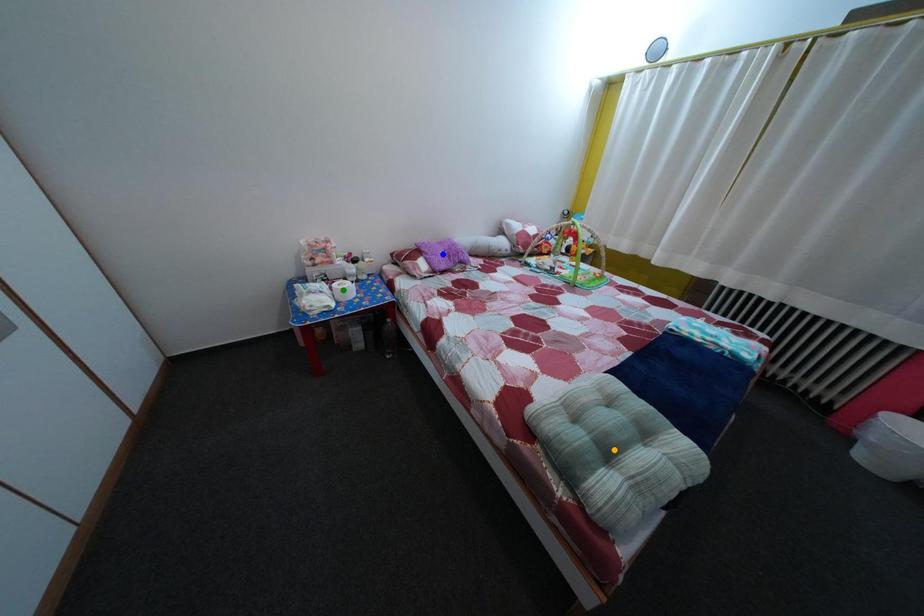
Order these from nearest to farthest:
1. blue point
2. orange point
3. green point

blue point → green point → orange point